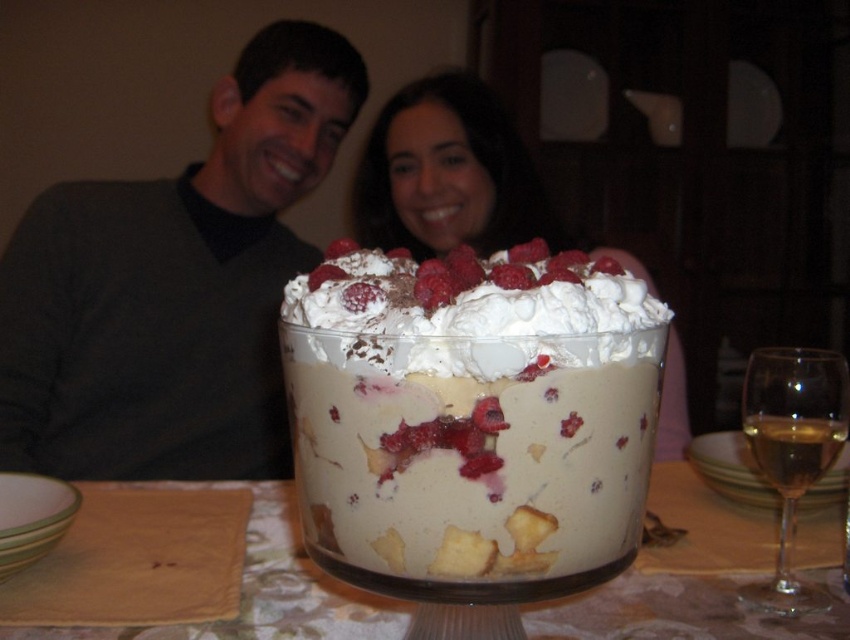
You are at a dinner party and need to place a napkin on the table. The napkin is currently on the left side of the dark gray sweater at center. Where should you place it so that it is to the right of the translucent glass wine at right?

The dark gray sweater at center is to the left of the translucent glass wine at right. To place the napkin to the right of the translucent glass wine at right, move it from the left side of the dark gray sweater at center to the right side of the translucent glass wine at right.

You are a guest at a dinner party and want to reach for the white creamy pudding at center. However, there is a translucent glass wine at right nearby. Considering their sizes, which item would require more space on the table to move around?

The white creamy pudding at center requires more space because it is larger in size than the translucent glass wine at right.